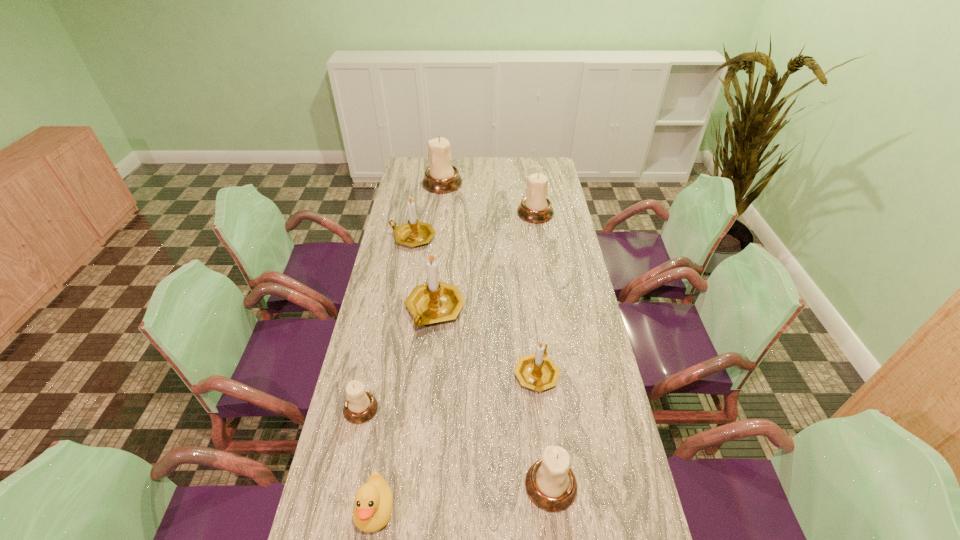
Identify the location of free location located on the left of the smallest gold candle holder. (424, 373).

The height and width of the screenshot is (540, 960). What are the coordinates of `vacant space positioned 0.090m on the front of the leftmost white candle holder` in the screenshot? It's located at (350, 456).

Where is `object that is at the far edge`? object that is at the far edge is located at coordinates (441, 177).

This screenshot has width=960, height=540. Identify the location of duck located in the left edge section of the desktop. (373, 502).

I want to click on object that is at the far left corner, so click(441, 177).

The image size is (960, 540). Find the location of `free space at the far edge of the desktop`. free space at the far edge of the desktop is located at coordinates (502, 176).

The height and width of the screenshot is (540, 960). In order to click on vacant area at the left edge of the desktop in this screenshot , I will do `click(418, 283)`.

The width and height of the screenshot is (960, 540). In order to click on free space at the right edge of the desktop in this screenshot , I will do `click(571, 261)`.

In order to click on free space between the nearest white candle holder and the farthest object in this screenshot , I will do `click(496, 334)`.

Find the location of a particular element. This screenshot has height=540, width=960. free space between the rightmost gold candle holder and the farthest white candle holder is located at coordinates (490, 278).